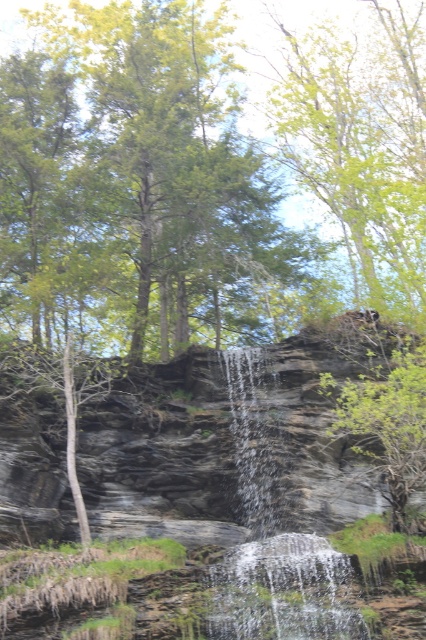
You are an interior designer planning to install a decorative waterfall feature in a client living room. The client has two options to choose from based on the image provided. The first option is the translucent glass waterfall at center, and the second is the clear glass waterfall at center. The client wants to know which one will take up more space in their living room. Which one should you recommend?

The clear glass waterfall at center occupies more space than the translucent glass waterfall at center, so you should recommend the clear glass waterfall at center as the option that takes up more space.

You are a hiker standing at the base of the translucent glass waterfall at center and want to take a photo of the green leafy tree at center. Since the waterfall is in front of you, will the tree be visible in your photo if you point the camera straight ahead?

The translucent glass waterfall at center is shorter than the green leafy tree at center, so part of the tree will be visible above the waterfall when pointing the camera straight ahead.

Consider the image. You are standing in the natural scene and want to take a photo of the translucent glass waterfall at center. The green leafy tree at center is blocking your view. Can you move to the left to get an unobstructed view?

The translucent glass waterfall at center is positioned under the green leafy tree at center. Moving to the left may not help because the tree is directly above the waterfall, so the obstruction might remain.